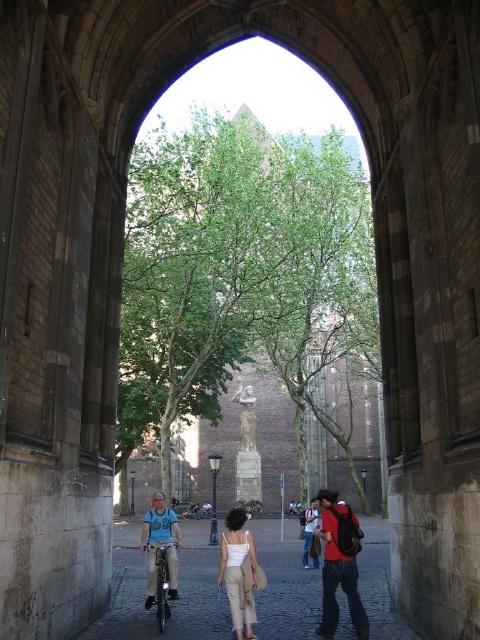
You are standing outside the arched stone gateway and want to take a photo of both the green leafy tree at center and the smooth stone statue at center. Which object should you focus on first if you want both to be in the frame without moving the camera?

You should focus on the green leafy tree at center first because it is larger than the smooth stone statue at center, ensuring it fits within the frame while the statue will naturally be included as it is smaller.

You are standing at the entrance of the arched stone gateway looking out into the cobblestone courtyard. You notice a matte red backpack at center. Based on its position coordinates, where exactly is the matte red backpack located in the courtyard?

The matte red backpack at center is located at coordinates point (339, 564) in the courtyard.